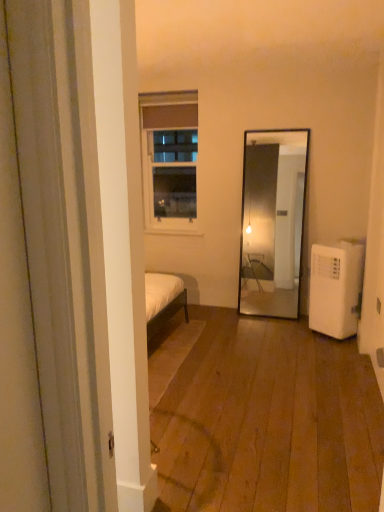
Question: Considering the positions of white glass window at upper center and white plastic air conditioner at lower right in the image, is white glass window at upper center wider or thinner than white plastic air conditioner at lower right?

Choices:
 (A) thin
 (B) wide

Answer: (A)

Question: Based on their positions, is white glass window at upper center located to the left or right of white plastic air conditioner at lower right?

Choices:
 (A) right
 (B) left

Answer: (B)

Question: Is point (185, 157) positioned closer to the camera than point (327, 304)?

Choices:
 (A) farther
 (B) closer

Answer: (A)

Question: Relative to white glass window at upper center, is white plastic air conditioner at lower right in front or behind?

Choices:
 (A) behind
 (B) front

Answer: (B)

Question: Would you say white plastic air conditioner at lower right is inside or outside white glass window at upper center?

Choices:
 (A) outside
 (B) inside

Answer: (A)

Question: Visually, is white plastic air conditioner at lower right positioned to the left or to the right of white glass window at upper center?

Choices:
 (A) right
 (B) left

Answer: (A)

Question: From the image's perspective, is white plastic air conditioner at lower right positioned above or below white glass window at upper center?

Choices:
 (A) below
 (B) above

Answer: (A)